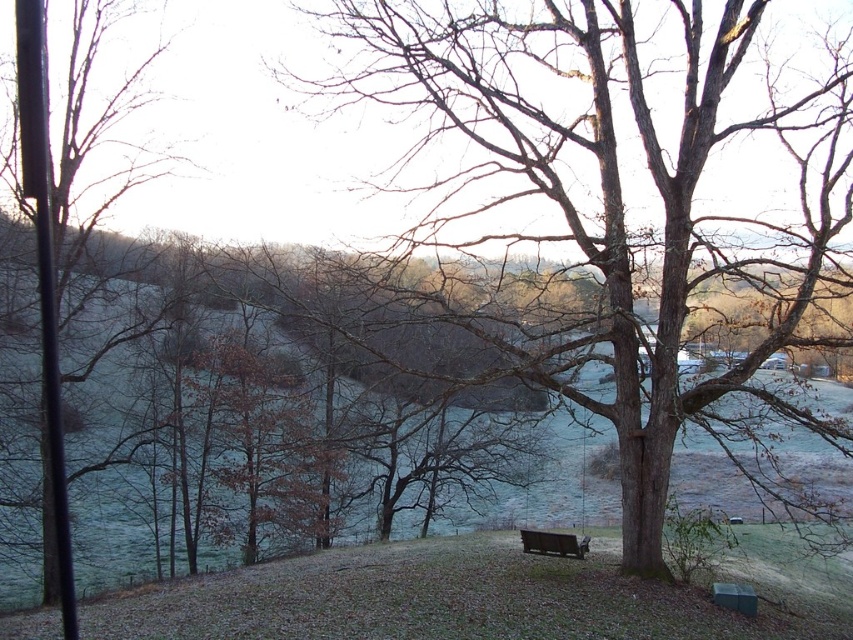
You are standing on the brown wooden bench at lower center and want to reach the brown rough textured tree at center. Which direction should you move to get closer to the tree?

Since the brown rough textured tree at center is located above the brown wooden bench at lower center, you should move upward to get closer to the tree.

You are standing at the base of the large tree in the foreground and want to walk towards the wooden swing. Which point, point (505, 132) or point (537, 552), is closer to your current position?

Point (505, 132) is closer to your current position because it is in front of point (537, 552).

In the scene shown: You are standing in the rural landscape and want to sit on the wooden swing. Which object, the brown rough textured tree at center or the bare branches at left, is directly above the swing?

The brown rough textured tree at center is positioned over the bare branches at left, so the brown rough textured tree at center is directly above the swing.